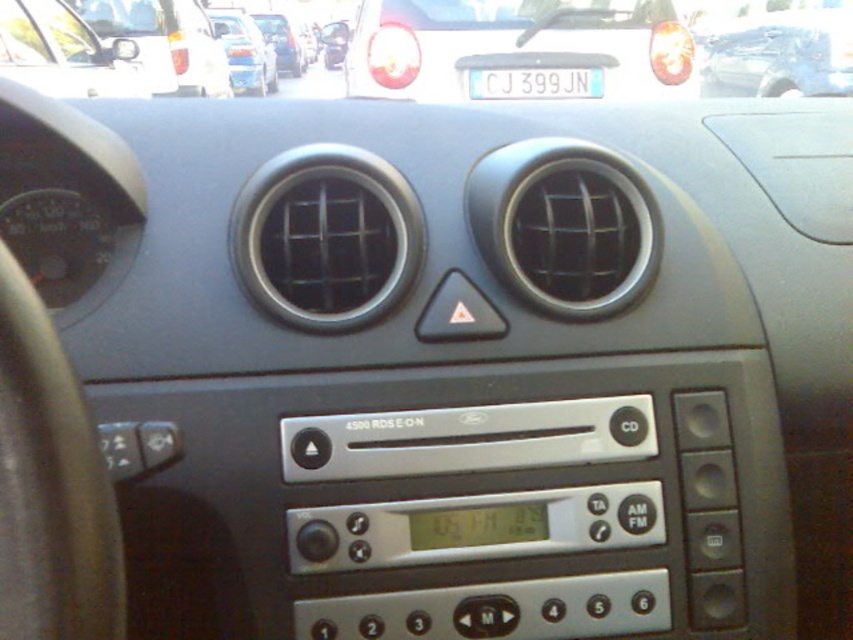
Question: Can you confirm if white glossy car at upper left is positioned to the right of white plastic license plate at center?

Choices:
 (A) yes
 (B) no

Answer: (B)

Question: Can you confirm if white plastic license plate at center is positioned below matte black car at center?

Choices:
 (A) yes
 (B) no

Answer: (A)

Question: Which of the following is the farthest from the observer?

Choices:
 (A) (291, 70)
 (B) (207, 12)
 (C) (553, 92)
 (D) (125, 65)

Answer: (A)

Question: Is metallic silver car at upper right smaller than metallic silver side mirror at upper left?

Choices:
 (A) yes
 (B) no

Answer: (B)

Question: Which object is farther from the camera taking this photo?

Choices:
 (A) matte black car at center
 (B) metallic silver side mirror at upper left
 (C) matte silver car at upper left

Answer: (A)

Question: Among these points, which one is nearest to the camera?

Choices:
 (A) (260, 42)
 (B) (265, 28)
 (C) (51, 92)

Answer: (C)